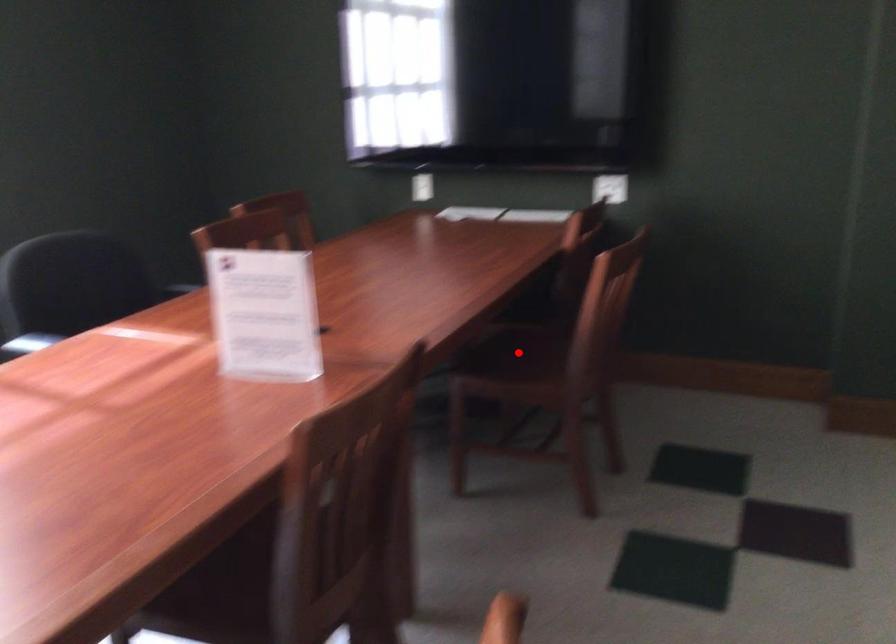
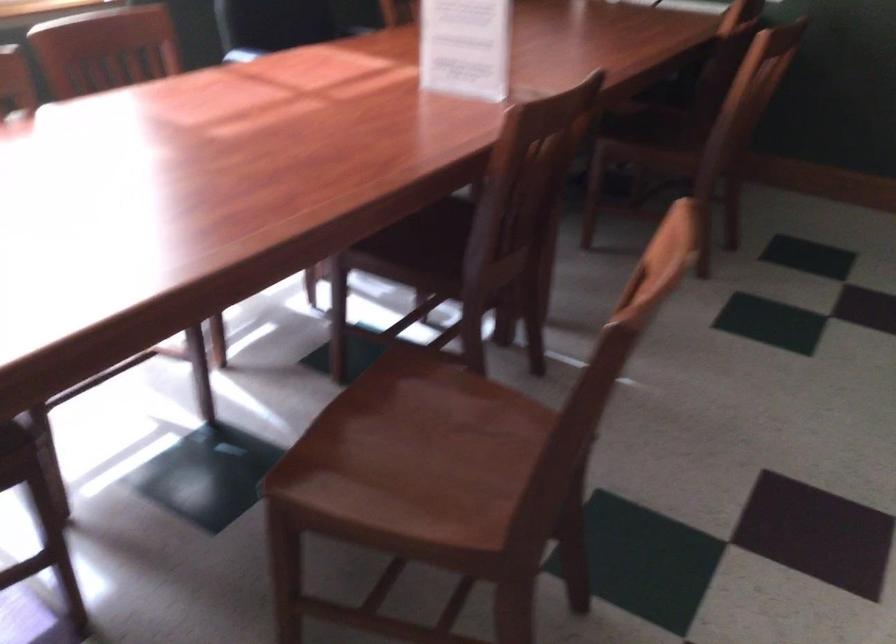
Where in the second image is the point corresponding to the highlighted location from the first image?

(659, 122)